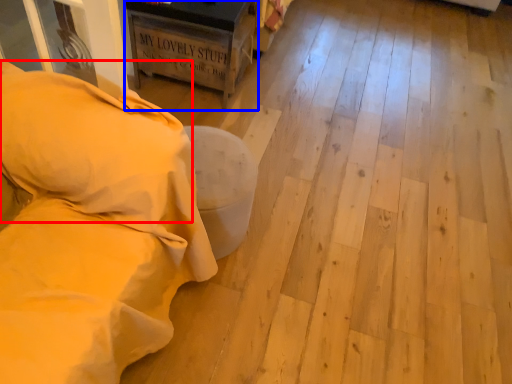
Question: Which of the following is the closest to the observer, pillow (highlighted by a red box) or furniture (highlighted by a blue box)?

Choices:
 (A) pillow
 (B) furniture

Answer: (A)